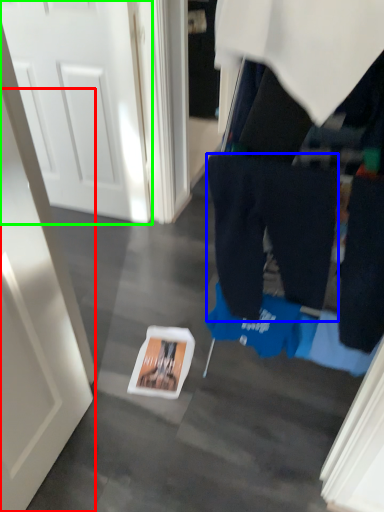
Question: Which is nearer to the door (highlighted by a red box)? trousers (highlighted by a blue box) or door (highlighted by a green box).

Choices:
 (A) trousers
 (B) door

Answer: (A)